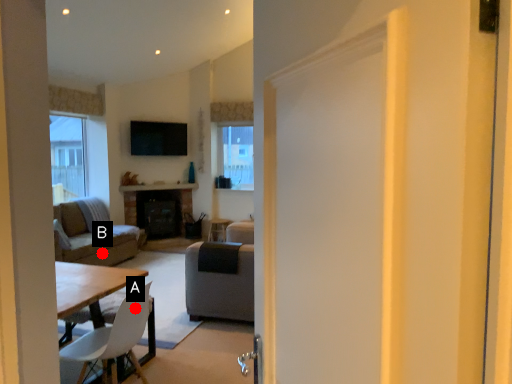
Question: Two points are circled on the image, labeled by A and B beside each circle. Which point is closer to the camera?

Choices:
 (A) A is closer
 (B) B is closer

Answer: (A)